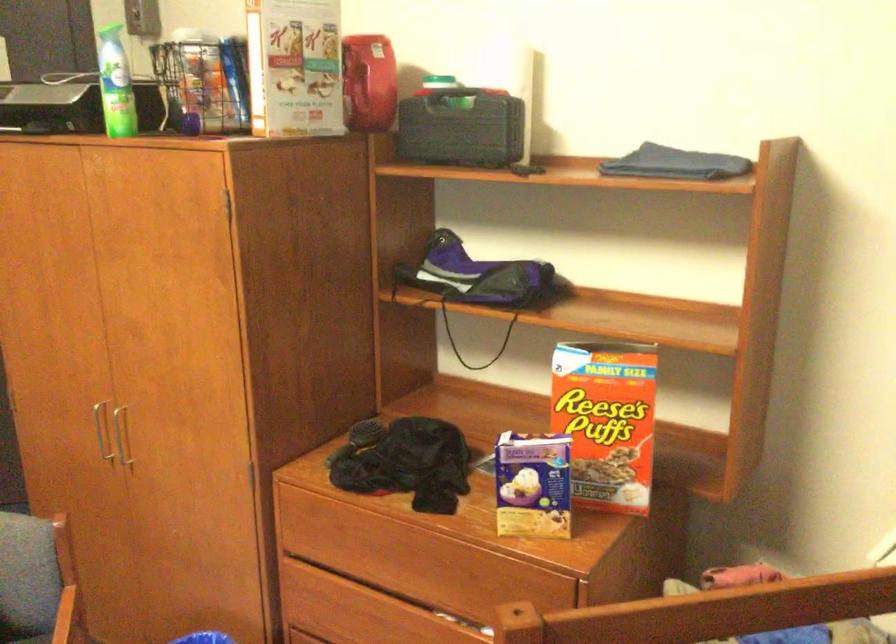
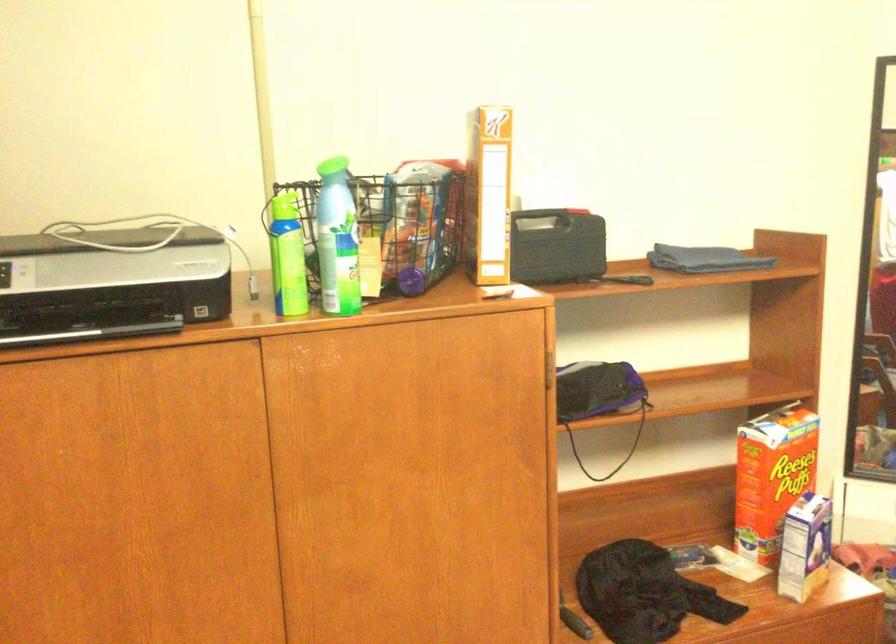
Locate, in the second image, the point that corresponds to the point at 555,415 in the first image.

(771, 477)